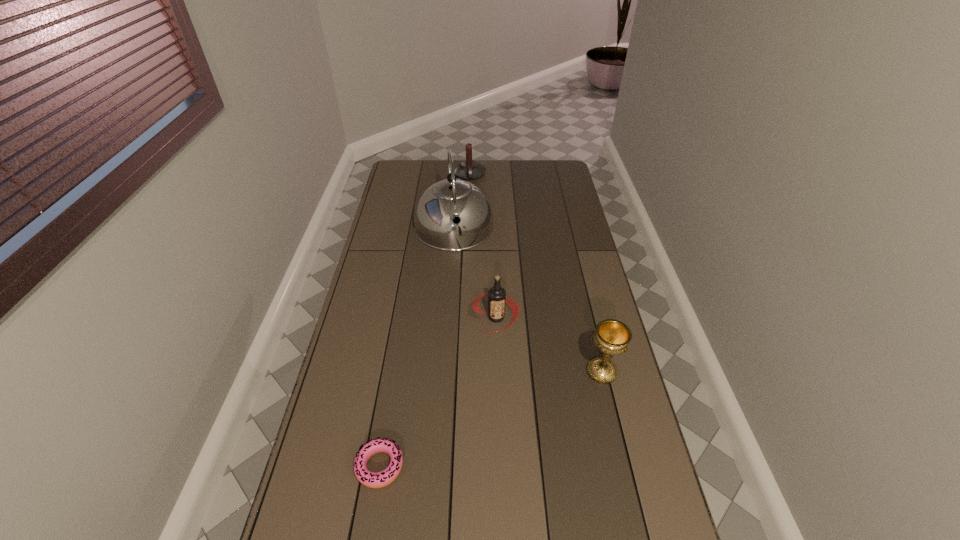
Find the location of `free space located on the side of the farthest object with the handle loop`. free space located on the side of the farthest object with the handle loop is located at coordinates (474, 218).

I want to click on vacant space located 0.110m on the side of the farthest object with the handle loop, so click(x=471, y=197).

Where is `free space located 0.260m on the side of the farthest object with the handle loop`? The image size is (960, 540). free space located 0.260m on the side of the farthest object with the handle loop is located at coordinates (x=473, y=214).

You are a GUI agent. You are given a task and a screenshot of the screen. Output one action in this format:
    pyautogui.click(x=<x>, y=<y>)
    Task: Click on the blank space located 0.350m on the label of the root beer
    The height and width of the screenshot is (540, 960).
    Given the screenshot: What is the action you would take?
    pyautogui.click(x=489, y=431)

Where is `free space located 0.200m on the label of the root beer`? The height and width of the screenshot is (540, 960). free space located 0.200m on the label of the root beer is located at coordinates (492, 386).

The width and height of the screenshot is (960, 540). In order to click on vacant space located 0.320m on the label of the root beer in this screenshot , I will do coord(490,422).

Where is `vacant area situated 0.070m from the spout of the second farthest object`? vacant area situated 0.070m from the spout of the second farthest object is located at coordinates (459, 268).

Where is `blank space located from the spout of the second farthest object`? Image resolution: width=960 pixels, height=540 pixels. blank space located from the spout of the second farthest object is located at coordinates [x=463, y=296].

Locate an element on the screen. free space located from the spout of the second farthest object is located at coordinates (459, 269).

The height and width of the screenshot is (540, 960). What are the coordinates of `object present at the far edge` in the screenshot? It's located at (468, 169).